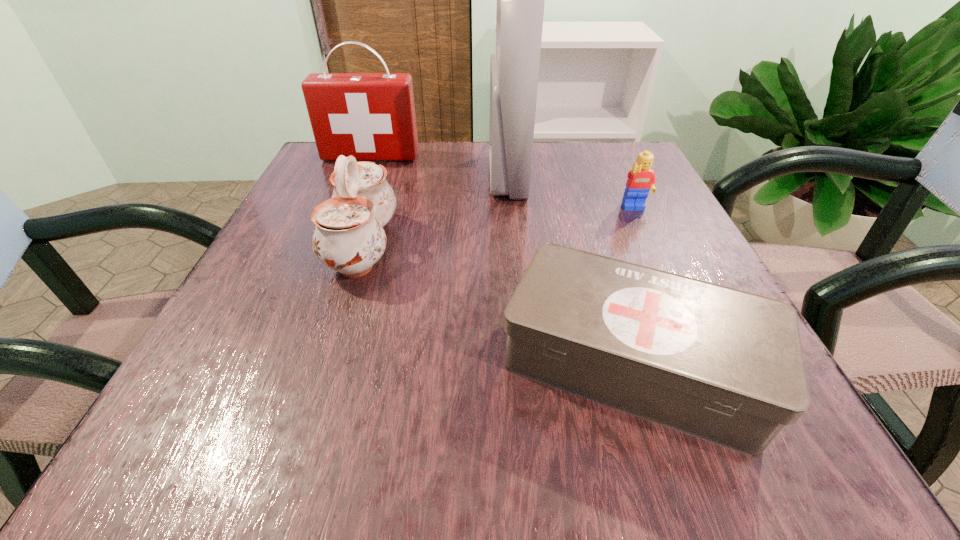
Locate an element on the screen. free space located 0.130m on the front face of the second tallest object is located at coordinates (356, 193).

The width and height of the screenshot is (960, 540). I want to click on vacant area situated by the handle of the third shortest object, so click(x=423, y=246).

Locate an element on the screen. vacant region located 0.060m on the face of the Lego is located at coordinates (647, 236).

This screenshot has width=960, height=540. What are the coordinates of `vacant space located 0.080m on the back of the shortest first-aid kit` in the screenshot? It's located at (600, 260).

The image size is (960, 540). Identify the location of object that is at the near edge. (724, 365).

The image size is (960, 540). I want to click on the first-aid kit located at the left edge, so click(371, 116).

Where is `chinaware located at the left edge`? Image resolution: width=960 pixels, height=540 pixels. chinaware located at the left edge is located at coordinates (349, 237).

Locate an element on the screen. Image resolution: width=960 pixels, height=540 pixels. Lego located in the right edge section of the desktop is located at coordinates (641, 180).

At what (x,y) coordinates should I click in order to perform the action: click on the first-aid kit located in the right edge section of the desktop. Please return your answer as a coordinate pair (x, y). The height and width of the screenshot is (540, 960). Looking at the image, I should click on (724, 365).

You are a GUI agent. You are given a task and a screenshot of the screen. Output one action in this format:
    pyautogui.click(x=<x>, y=<y>)
    Task: Click on the object at the far left corner
    Image resolution: width=960 pixels, height=540 pixels.
    Given the screenshot: What is the action you would take?
    pyautogui.click(x=371, y=116)